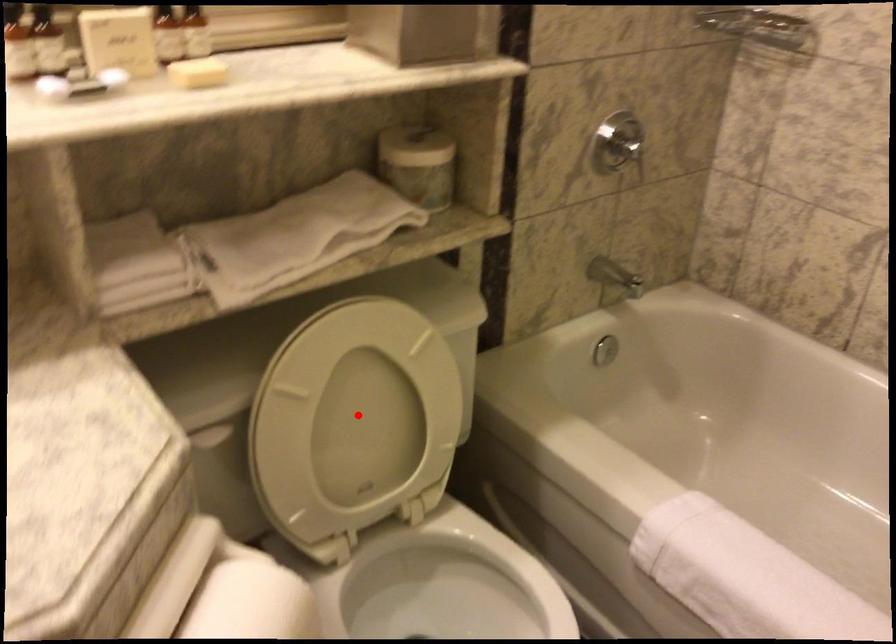
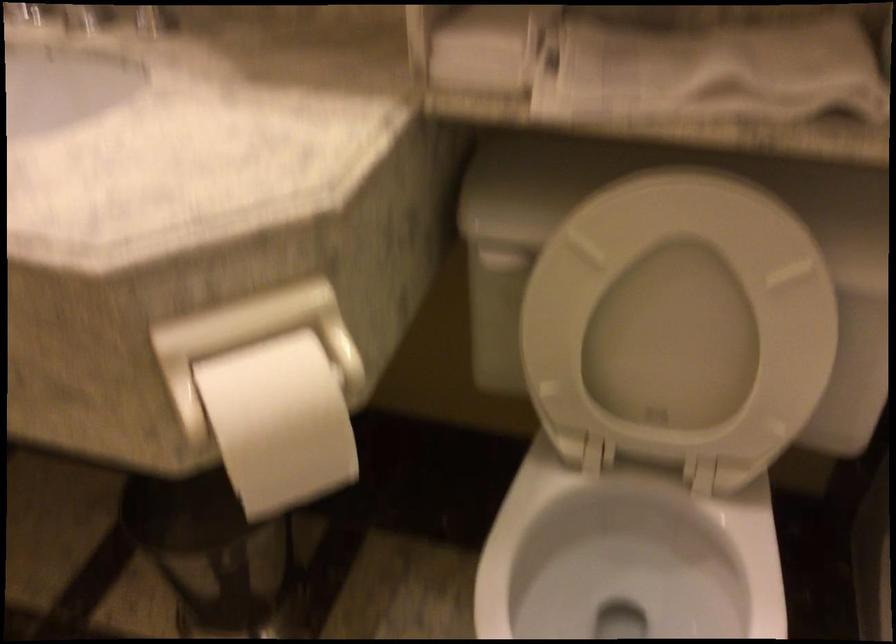
The point at the highlighted location is marked in the first image. Where is the corresponding point in the second image?

(678, 322)